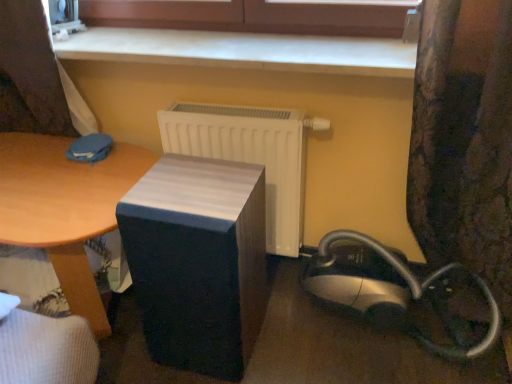
Where is `free space above matte black speaker at center (from a real-world perspective)`? free space above matte black speaker at center (from a real-world perspective) is located at coordinates (199, 189).